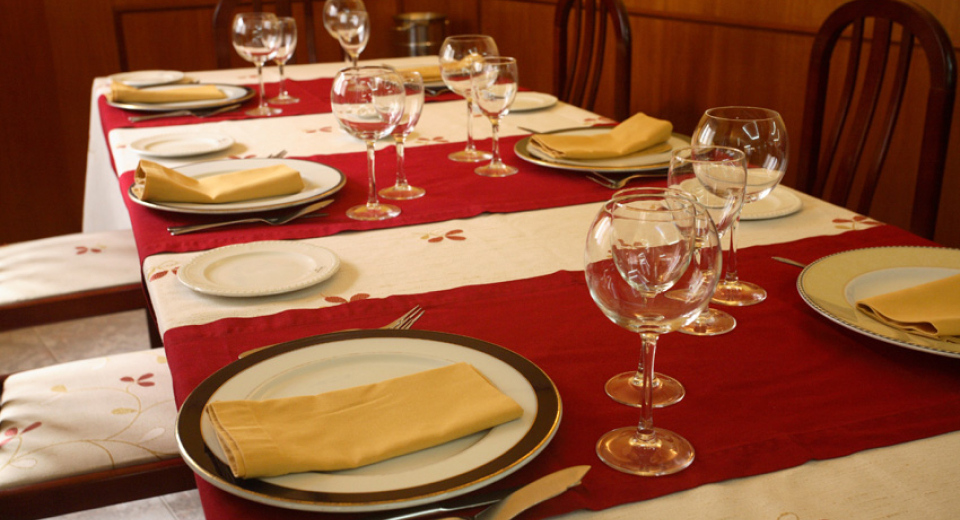
The height and width of the screenshot is (520, 960). In order to click on large plates in this screenshot , I will do `click(357, 363)`, `click(855, 278)`, `click(624, 167)`, `click(328, 184)`, `click(238, 95)`.